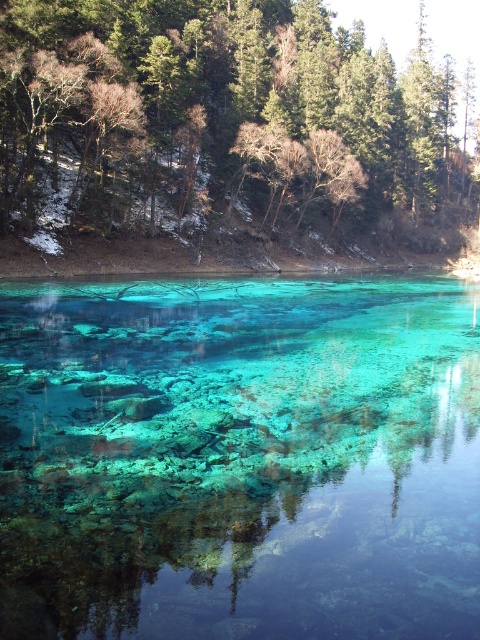
Question: Can you confirm if translucent teal water at center is positioned to the left of green leafy tree at upper center?

Choices:
 (A) no
 (B) yes

Answer: (B)

Question: Which point is closer to the camera?

Choices:
 (A) (471, 442)
 (B) (104, 49)

Answer: (A)

Question: Does translucent teal water at center appear over green leafy tree at upper center?

Choices:
 (A) yes
 (B) no

Answer: (B)

Question: Which object appears closest to the camera in this image?

Choices:
 (A) translucent teal water at center
 (B) green leafy tree at upper center

Answer: (A)

Question: Is translucent teal water at center closer to camera compared to green leafy tree at upper center?

Choices:
 (A) yes
 (B) no

Answer: (A)

Question: Which point is closer to the camera?

Choices:
 (A) green leafy tree at upper center
 (B) translucent teal water at center

Answer: (B)